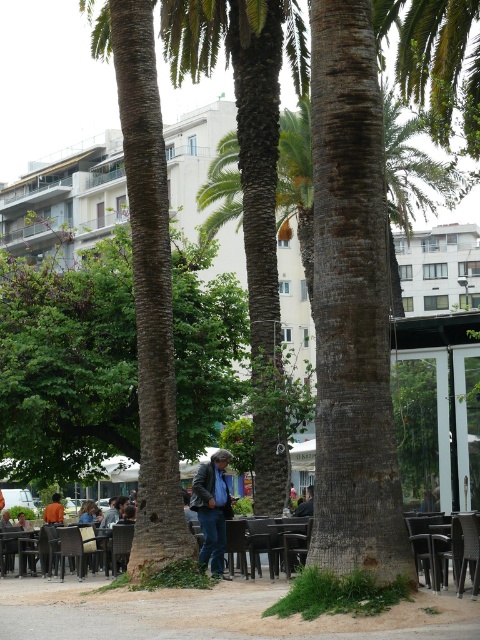
You are standing at the center of the outdoor cafe scene. There is a point marked at coordinates (68, 364). Based on the scene description, what object is located at that point?

The point at coordinates (68, 364) indicates the location of the green rough bark tree at center.

You are a photographer setting up a tripod in the outdoor cafe scene. You need to position the tripod so it doesn not block the view of the black plastic chair at lower center. Where should you place the tripod in relation to the blue denim jeans at center?

Place the tripod to the right of the blue denim jeans at center since the blue denim jeans at center is to the left of the black plastic chair at lower center, meaning the chair is to the right of the jeans. Positioning the tripod to the right of the jeans would keep it away from the chair and avoid blocking the view.

You are trying to decide whether to place a new bench next to the black plastic chair at lower right without blocking the view of the green rough bark tree at center. Based on their widths, can the bench be placed there?

The green rough bark tree at center might be wider than the black plastic chair at lower right, so placing the bench next to the chair might not block the tree view if the chair is narrower. However, the exact width difference is uncertain, so it depends on the bench size.